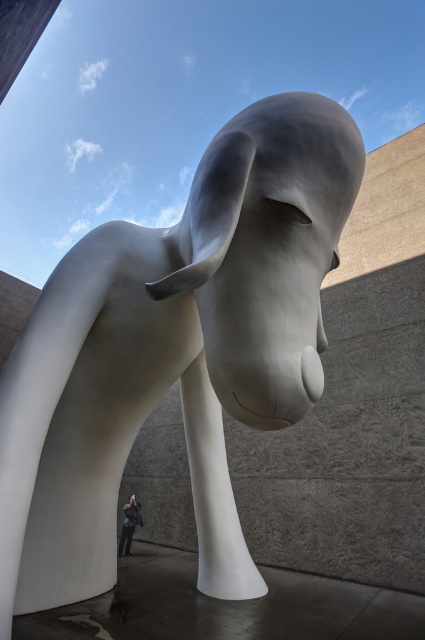
Question: In this image, where is satin silver sculpture at center located relative to blue fabric jacket at lower center?

Choices:
 (A) right
 (B) left

Answer: (A)

Question: Is white glossy sculpture at center to the right of blue fabric jacket at lower center from the viewer's perspective?

Choices:
 (A) yes
 (B) no

Answer: (A)

Question: Which object is farther from the camera taking this photo?

Choices:
 (A) blue fabric jacket at lower center
 (B) white glossy sculpture at center
 (C) satin silver sculpture at center

Answer: (A)

Question: Does white glossy sculpture at center have a greater width compared to satin silver sculpture at center?

Choices:
 (A) yes
 (B) no

Answer: (A)

Question: Which object is farther from the camera taking this photo?

Choices:
 (A) blue fabric jacket at lower center
 (B) white glossy sculpture at center

Answer: (A)

Question: Which object appears farthest from the camera in this image?

Choices:
 (A) white glossy sculpture at center
 (B) satin silver sculpture at center
 (C) blue fabric jacket at lower center

Answer: (C)